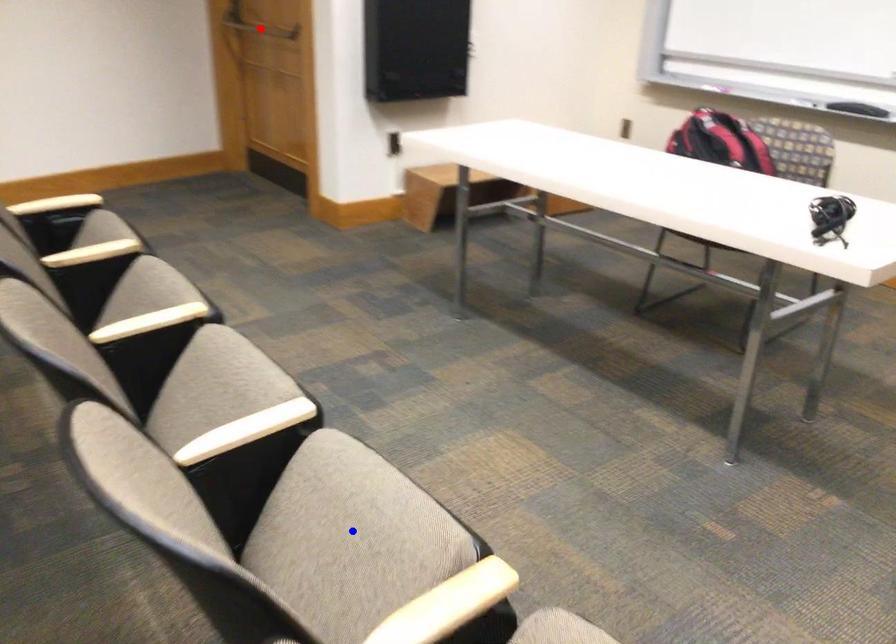
Question: Two points are marked on the image. Which point is closer to the camera?

Choices:
 (A) Blue point is closer.
 (B) Red point is closer.

Answer: (A)